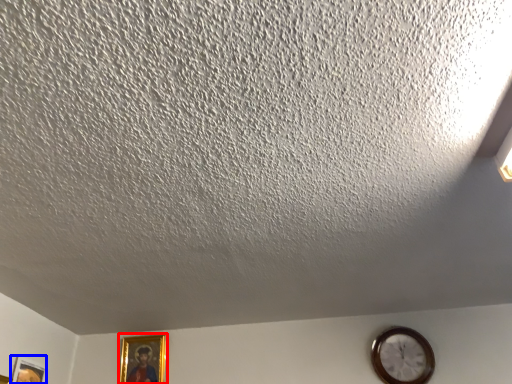
Question: Among these objects, which one is farthest to the camera, picture frame (highlighted by a red box) or picture frame (highlighted by a blue box)?

Choices:
 (A) picture frame
 (B) picture frame

Answer: (A)